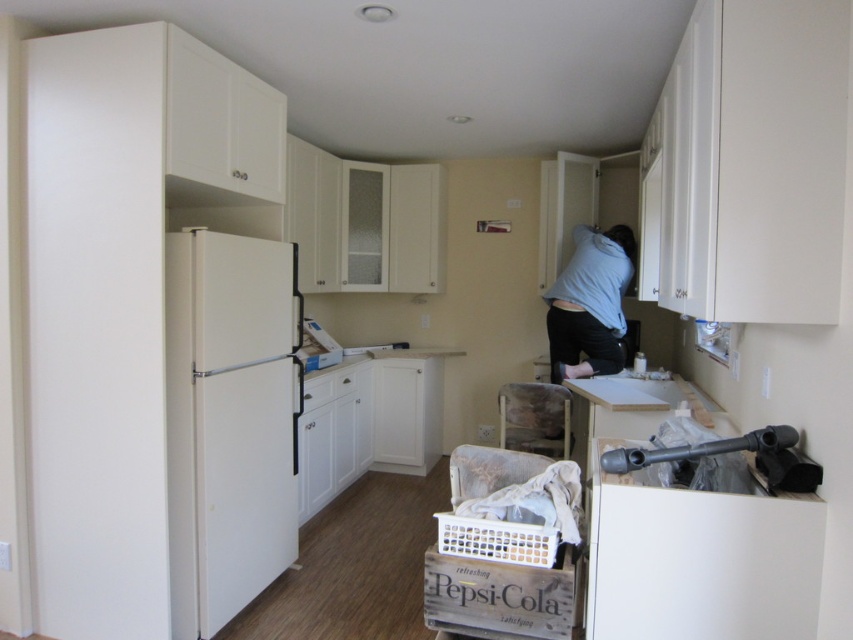
Is point (283, 483) positioned after point (572, 326)?

That is False.

Find the location of a particular element. white matte refrigerator at left is located at coordinates (228, 422).

Locate an element on the screen. white matte refrigerator at left is located at coordinates (228, 422).

Who is more forward, (x=242, y=275) or (x=465, y=529)?

Point (x=465, y=529)

The image size is (853, 640). Describe the element at coordinates (228, 422) in the screenshot. I see `white matte refrigerator at left` at that location.

Identify the location of white matte refrigerator at left. pos(228,422).

Between blue cotton shirt at upper center and white plastic crate at lower center, which one appears on the left side from the viewer's perspective?

white plastic crate at lower center is more to the left.

Measure the distance between blue cotton shirt at upper center and camera.

They are 3.96 meters apart.

The image size is (853, 640). What are the coordinates of `blue cotton shirt at upper center` in the screenshot? It's located at (590, 304).